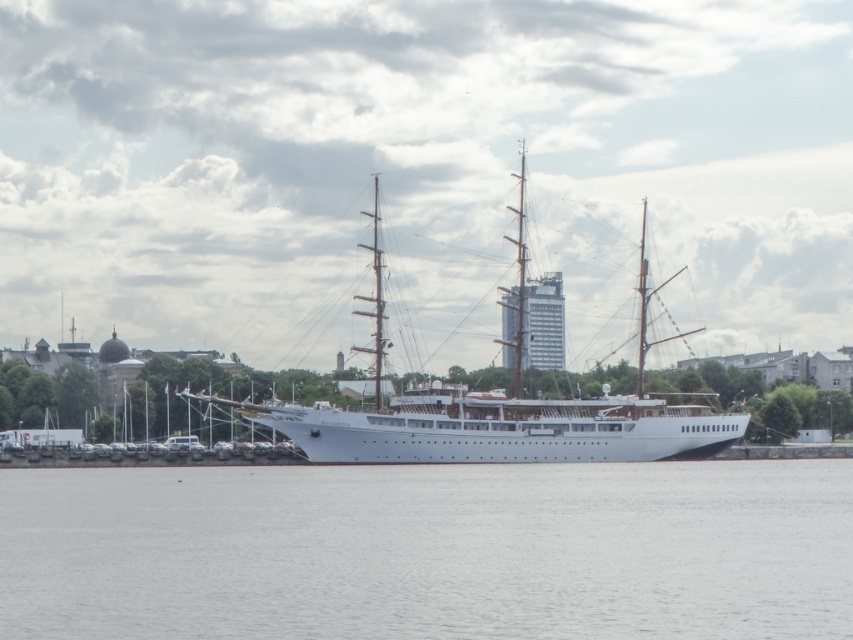
Is clear water at lower center taller than white matte ship at center?

No.

Who is taller, clear water at lower center or white matte ship at center?

With more height is white matte ship at center.

The width and height of the screenshot is (853, 640). Describe the element at coordinates (428, 550) in the screenshot. I see `clear water at lower center` at that location.

Identify the location of clear water at lower center. Image resolution: width=853 pixels, height=640 pixels. 428,550.